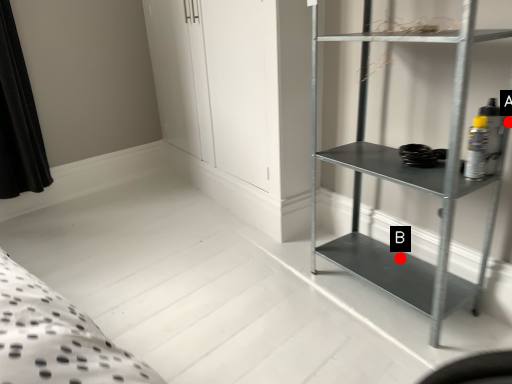
Question: Two points are circled on the image, labeled by A and B beside each circle. Among these points, which one is farthest from the camera?

Choices:
 (A) A is further
 (B) B is further

Answer: (B)